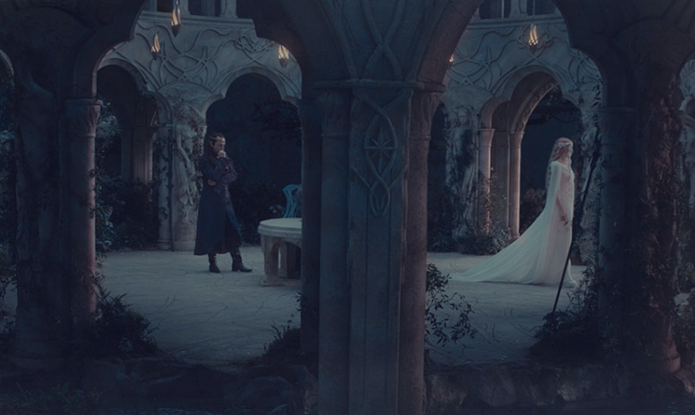
Where is `light`? light is located at coordinates (147, 48), (167, 22), (284, 55), (452, 59), (534, 37).